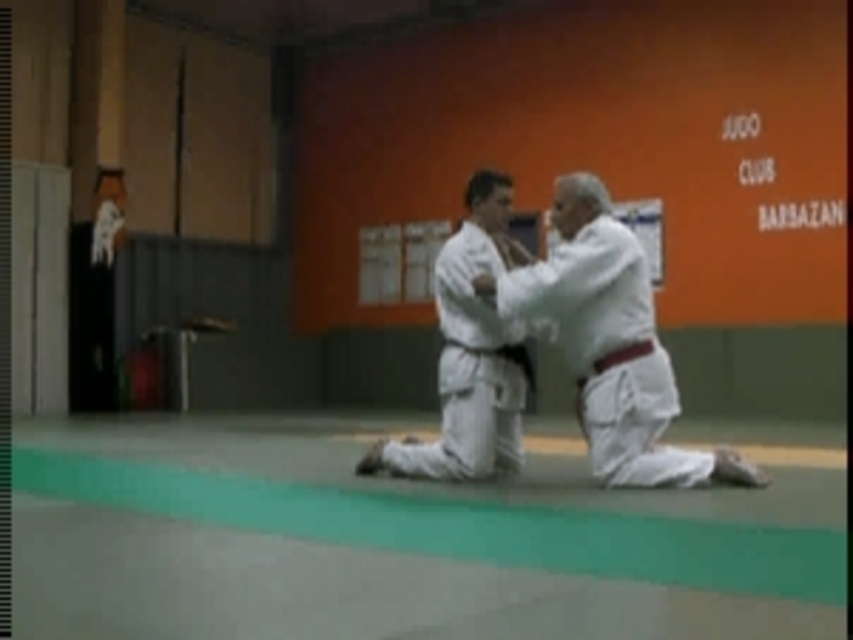
Question: Is white cloth kimono at center wider than white matte kimono at center?

Choices:
 (A) yes
 (B) no

Answer: (A)

Question: Is white cloth kimono at center below white matte kimono at center?

Choices:
 (A) no
 (B) yes

Answer: (B)

Question: Which object is closer to the camera taking this photo?

Choices:
 (A) white matte kimono at center
 (B) white cloth kimono at center

Answer: (B)

Question: Among these objects, which one is farthest from the camera?

Choices:
 (A) white cloth kimono at center
 (B) white matte kimono at center

Answer: (B)

Question: Can you confirm if white cloth kimono at center is positioned to the left of white matte kimono at center?

Choices:
 (A) yes
 (B) no

Answer: (B)